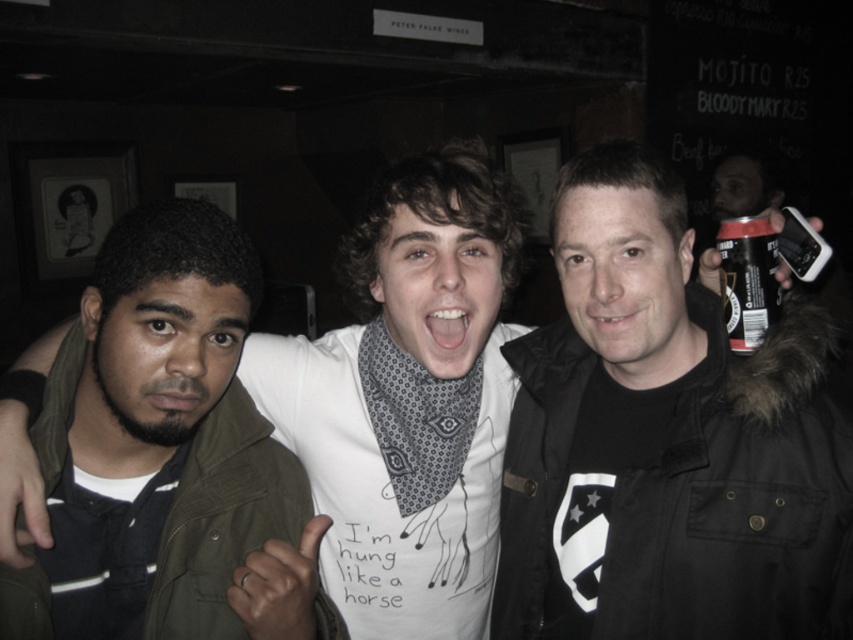
Does black matte jacket at center appear under green matte jacket at left?

No.

Can you confirm if black matte jacket at center is shorter than green matte jacket at left?

In fact, black matte jacket at center may be taller than green matte jacket at left.

Identify the location of black matte jacket at center. This screenshot has height=640, width=853. (665, 442).

The height and width of the screenshot is (640, 853). I want to click on black matte jacket at center, so click(x=665, y=442).

Is green matte jacket at left wider than black matte can at upper right?

Indeed, green matte jacket at left has a greater width compared to black matte can at upper right.

Between point (99, 417) and point (747, 234), which one is positioned in front?

Point (99, 417)

Which is in front, point (215, 454) or point (737, 326)?

Point (215, 454) is in front.

Find the location of a particular element. green matte jacket at left is located at coordinates (190, 417).

Who is taller, black matte jacket at center or black matte can at upper right?

With more height is black matte jacket at center.

Does black matte jacket at center have a lesser height compared to black matte can at upper right?

No.

The width and height of the screenshot is (853, 640). I want to click on black matte jacket at center, so click(x=665, y=442).

The image size is (853, 640). Find the location of `black matte jacket at center`. black matte jacket at center is located at coordinates (665, 442).